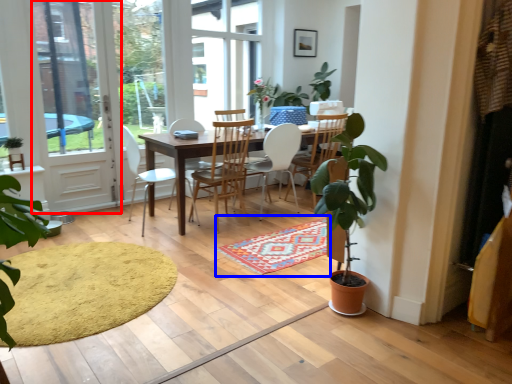
Question: Which of the following is the farthest to the observer, screen door (highlighted by a red box) or doormat (highlighted by a blue box)?

Choices:
 (A) screen door
 (B) doormat

Answer: (A)